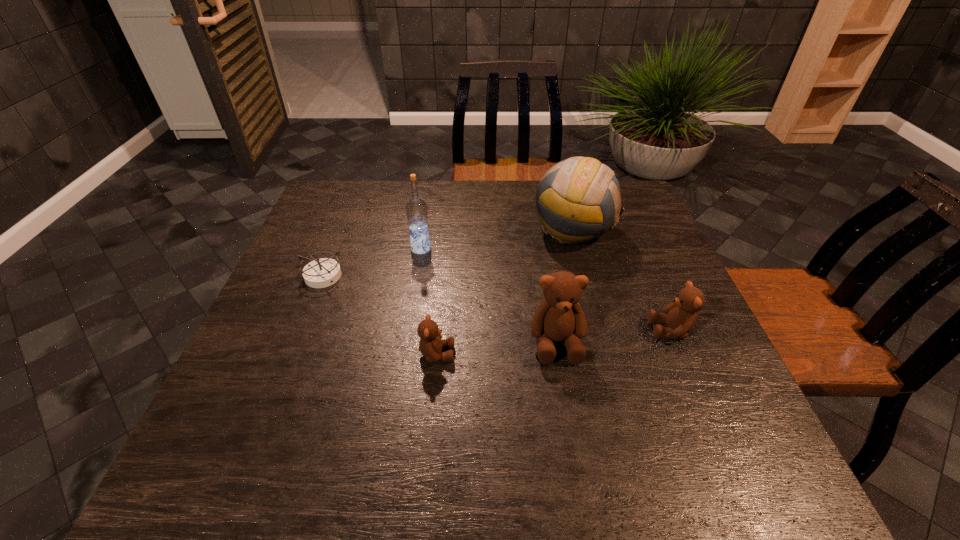
What are the coordinates of `free space located 0.330m on the face of the shortest teddy bear` in the screenshot? It's located at (608, 354).

At what (x,y) coordinates should I click in order to perform the action: click on vacant space located 0.090m on the face of the second teddy bear from right to left. Please return your answer as a coordinate pair (x, y). This screenshot has height=540, width=960. Looking at the image, I should click on tap(567, 404).

Where is `vacant space located 0.260m on the face of the second tallest teddy bear`? The image size is (960, 540). vacant space located 0.260m on the face of the second tallest teddy bear is located at coordinates (535, 330).

Where is `vacant position located on the face of the second tallest teddy bear`? This screenshot has height=540, width=960. vacant position located on the face of the second tallest teddy bear is located at coordinates (601, 330).

The height and width of the screenshot is (540, 960). Identify the location of vacant region located 0.360m on the face of the second tallest teddy bear. (491, 330).

Where is `free region located on the left of the volleyball`? This screenshot has height=540, width=960. free region located on the left of the volleyball is located at coordinates (457, 230).

Image resolution: width=960 pixels, height=540 pixels. What are the coordinates of `vacant position located 0.310m on the front of the vodka` in the screenshot? It's located at (406, 345).

The height and width of the screenshot is (540, 960). What are the coordinates of `free space located on the right of the leftmost object` in the screenshot? It's located at (431, 276).

This screenshot has height=540, width=960. Find the location of `object located in the far edge section of the desktop`. object located in the far edge section of the desktop is located at coordinates (578, 199).

Find the location of a particular element. object at the left edge is located at coordinates (324, 272).